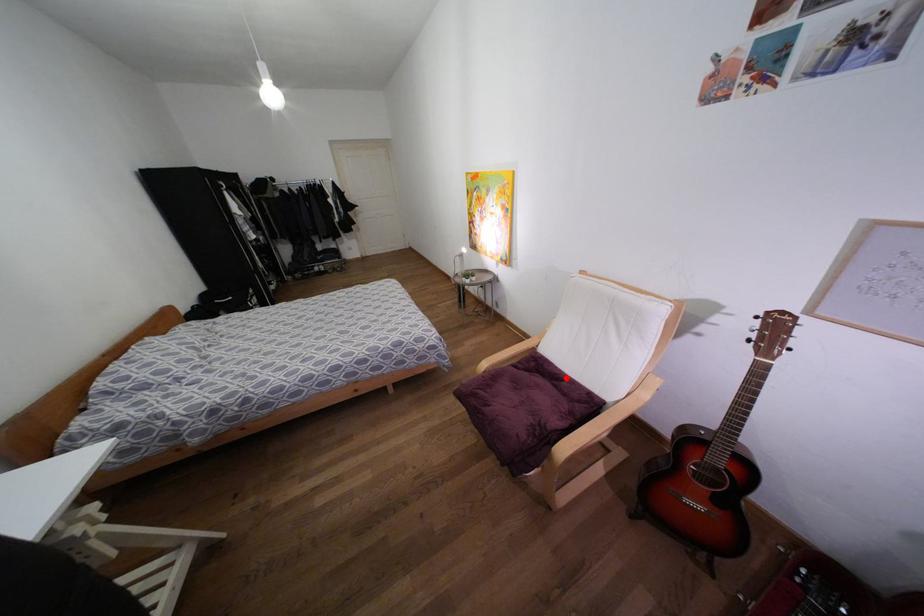
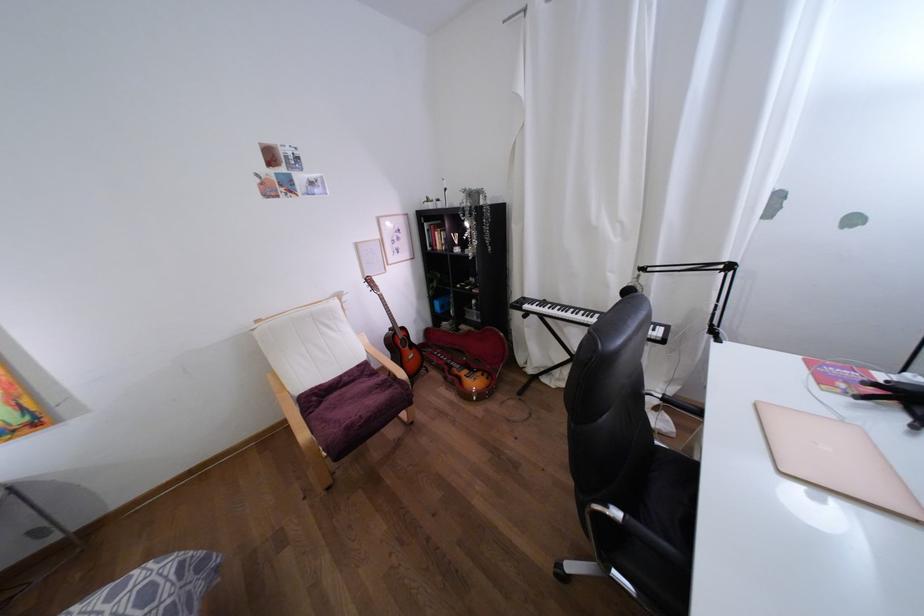
Where in the second image is the point corresponding to the highlighted location from the first image?

(339, 377)